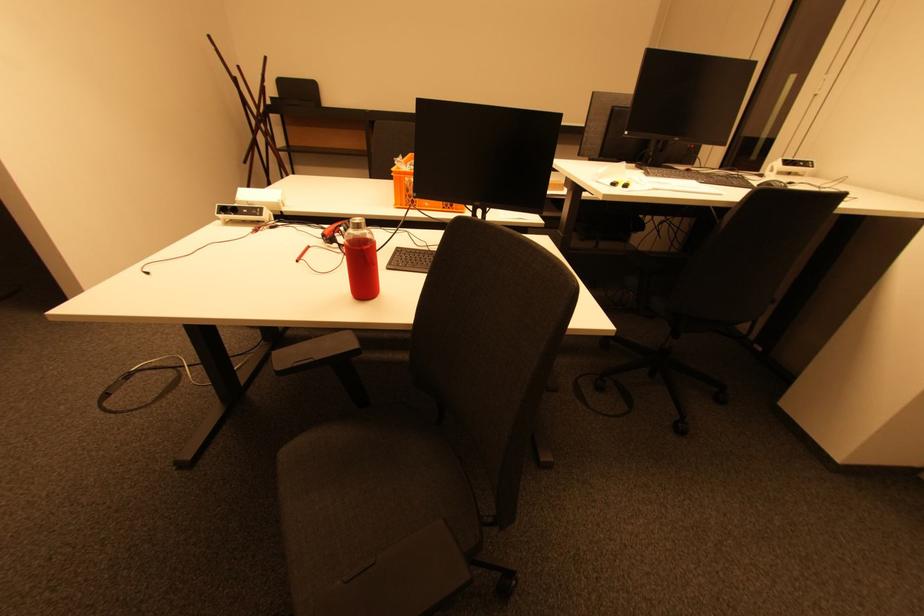
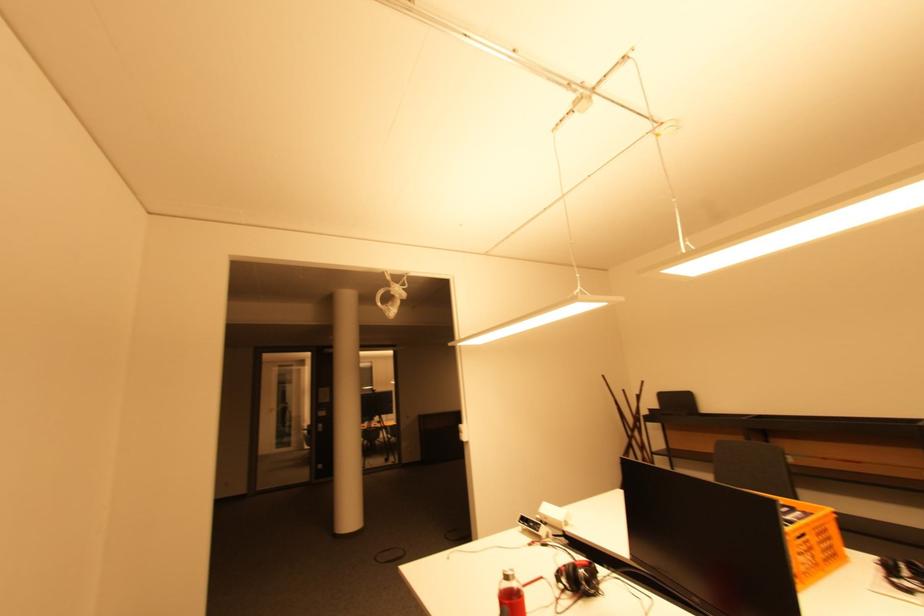
The first image is from the beginning of the video and the second image is from the end. How did the camera likely rotate when shooting the video?

The rotation direction of the camera is left-up.